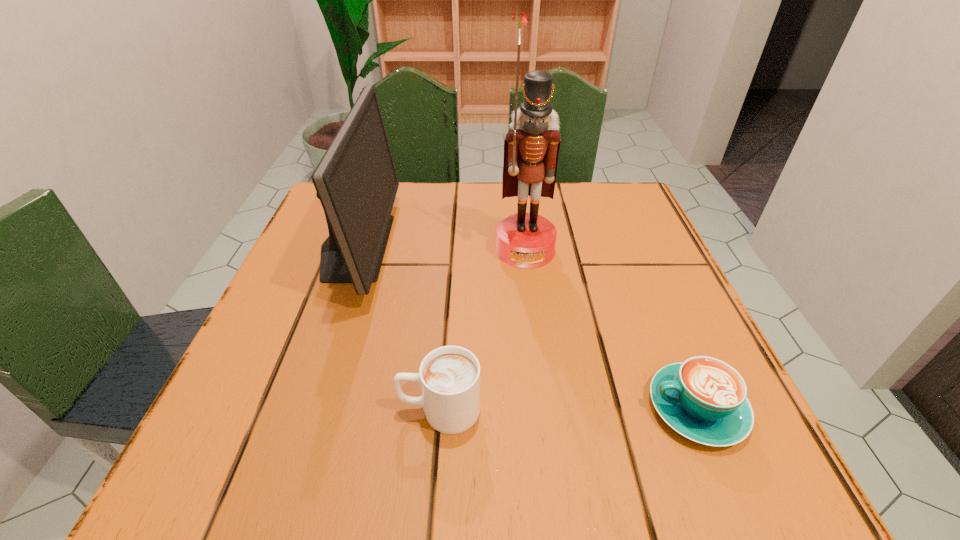
The width and height of the screenshot is (960, 540). In order to click on object that is at the far left corner in this screenshot , I will do coord(356,181).

Where is `object at the near right corner`? The image size is (960, 540). object at the near right corner is located at coordinates (704, 399).

Where is `free space at the far edge of the desktop`? This screenshot has width=960, height=540. free space at the far edge of the desktop is located at coordinates (483, 188).

Find the location of a particular element. vacant space at the near edge is located at coordinates (471, 475).

At what (x,y) coordinates should I click in order to perform the action: click on free space at the left edge of the desktop. Please return your answer as a coordinate pair (x, y). Image resolution: width=960 pixels, height=540 pixels. Looking at the image, I should click on (291, 328).

You are a GUI agent. You are given a task and a screenshot of the screen. Output one action in this format:
    pyautogui.click(x=<x>, y=<y>)
    Task: Click on the vacant space at the right edge of the desktop
    Image resolution: width=960 pixels, height=540 pixels.
    Given the screenshot: What is the action you would take?
    pyautogui.click(x=635, y=240)

You are a GUI agent. You are given a task and a screenshot of the screen. Output one action in this format:
    pyautogui.click(x=<x>, y=<y>)
    Task: Click on the free location at the near left corner of the desktop
    Image resolution: width=960 pixels, height=540 pixels.
    Given the screenshot: What is the action you would take?
    pyautogui.click(x=271, y=426)

Find the location of a particular element. This screenshot has height=540, width=960. free region at the far right corner of the desktop is located at coordinates (571, 190).

In order to click on vacant region between the second object from left to right and the shortest object in this screenshot , I will do `click(568, 409)`.

Locate an element on the screen. Image resolution: width=960 pixels, height=540 pixels. blank region between the third shortest object and the third object from left to right is located at coordinates (441, 248).